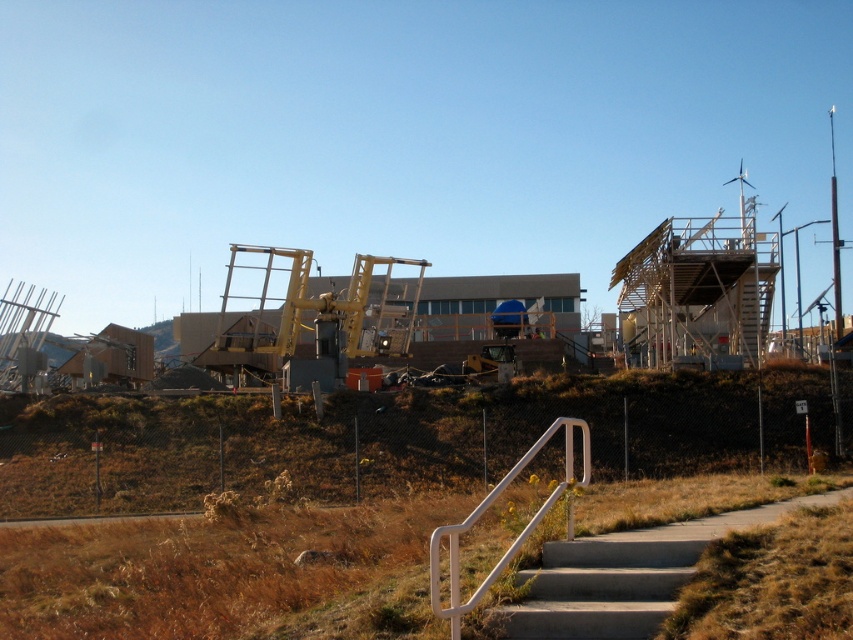
Question: Is concrete/steps at lower right positioned behind white plastic handrail at lower center?

Choices:
 (A) yes
 (B) no

Answer: (A)

Question: Is concrete/steps at lower right further to camera compared to white plastic handrail at lower center?

Choices:
 (A) no
 (B) yes

Answer: (B)

Question: Which object is farther from the camera taking this photo?

Choices:
 (A) white plastic handrail at lower center
 (B) concrete/steps at lower right

Answer: (B)

Question: Where is concrete/steps at lower right located in relation to white plastic handrail at lower center in the image?

Choices:
 (A) above
 (B) below

Answer: (A)

Question: Which point is farther to the camera?

Choices:
 (A) white plastic handrail at lower center
 (B) concrete/steps at lower right

Answer: (B)